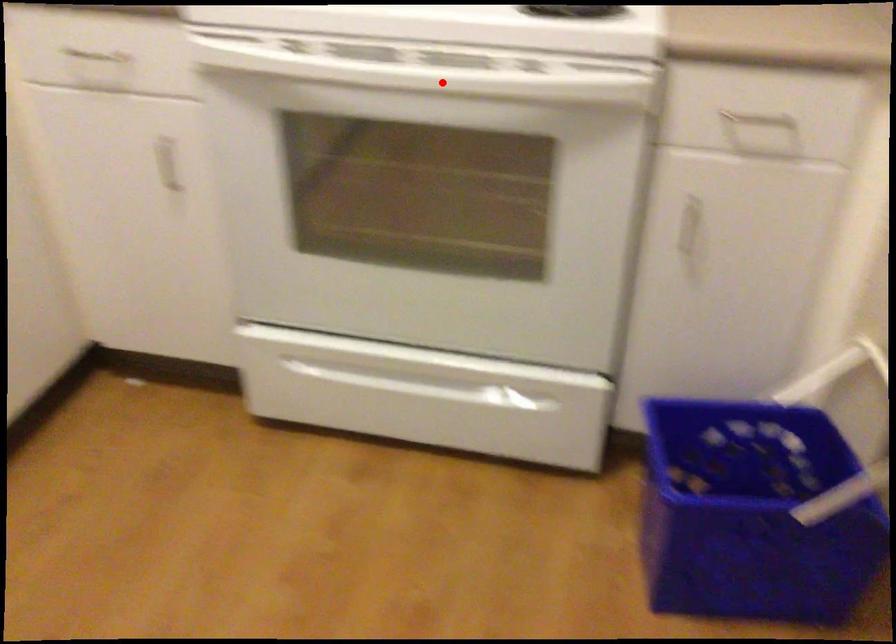
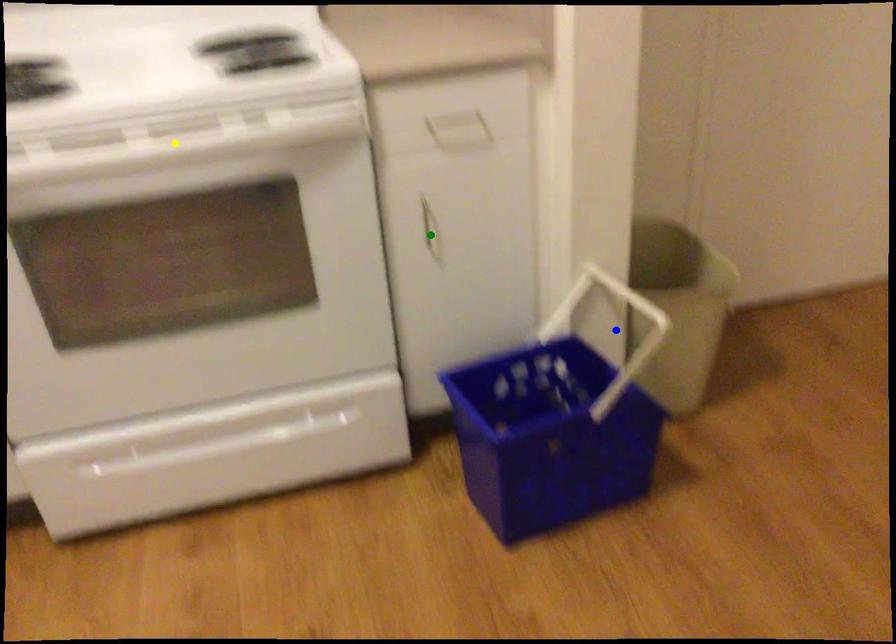
Question: I am providing you with two images of the same scene from different viewpoints. A red point is marked on the first image. You are given multiple points on the second image. Can you choose the point in image 2 that corresponds to the point in image 1?

Choices:
 (A) blue point
 (B) green point
 (C) yellow point

Answer: (C)